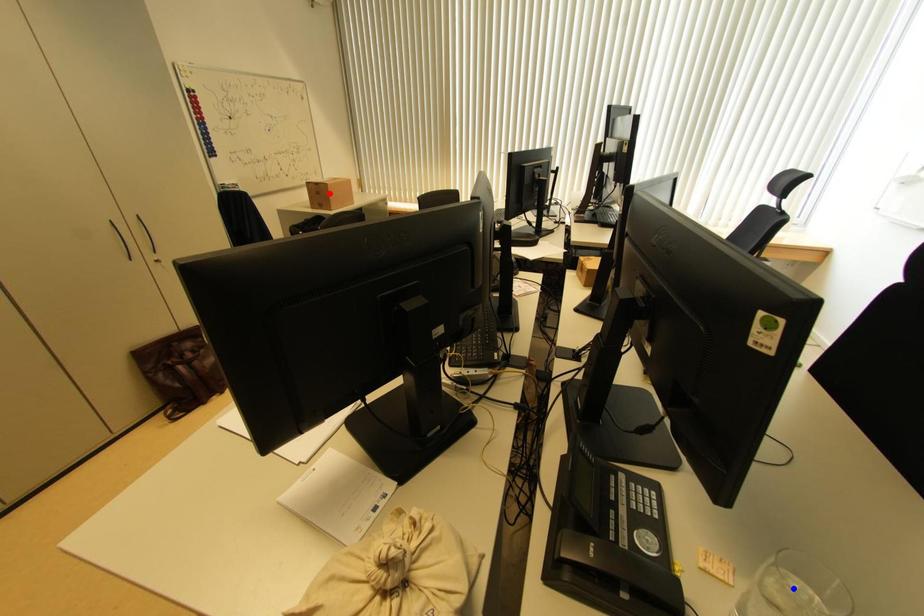
Question: Which of the two points in the image is closer to the camera?

Choices:
 (A) Blue point is closer.
 (B) Red point is closer.

Answer: (A)